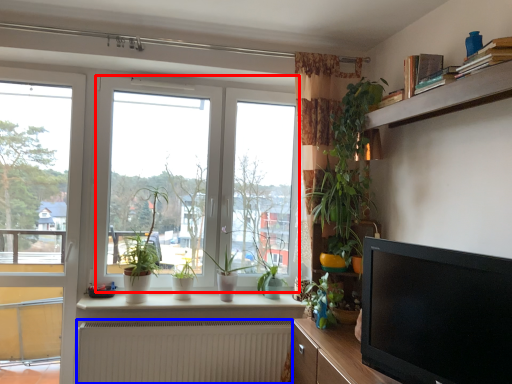
Question: Which object appears farthest to the camera in this image, window (highlighted by a red box) or radiator (highlighted by a blue box)?

Choices:
 (A) window
 (B) radiator

Answer: (A)